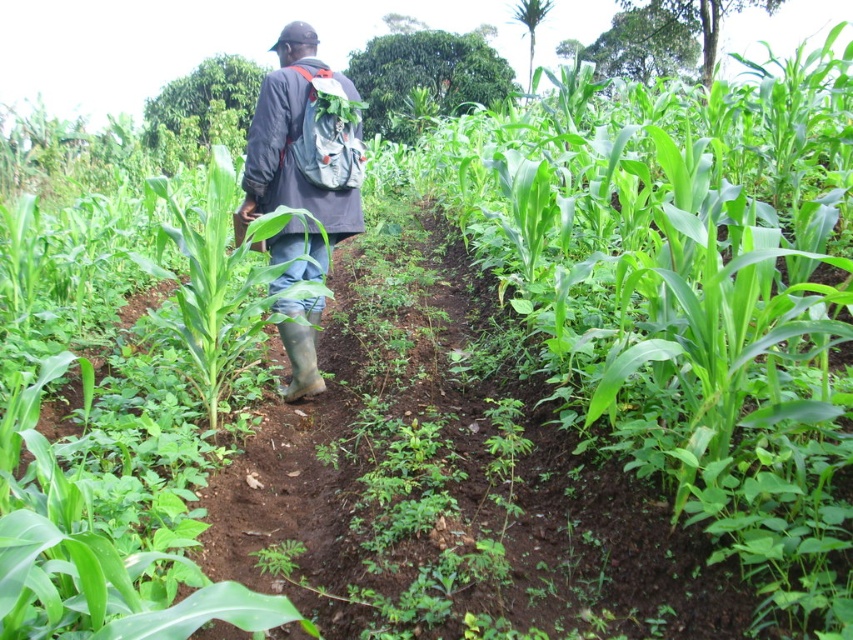
Does green leafy corn at center appear under gray fabric backpack at center?

No.

Between green leafy corn at center and gray fabric backpack at center, which one appears on the left side from the viewer's perspective?

From the viewer's perspective, gray fabric backpack at center appears more on the left side.

Locate an element on the screen. The width and height of the screenshot is (853, 640). green leafy corn at center is located at coordinates (683, 292).